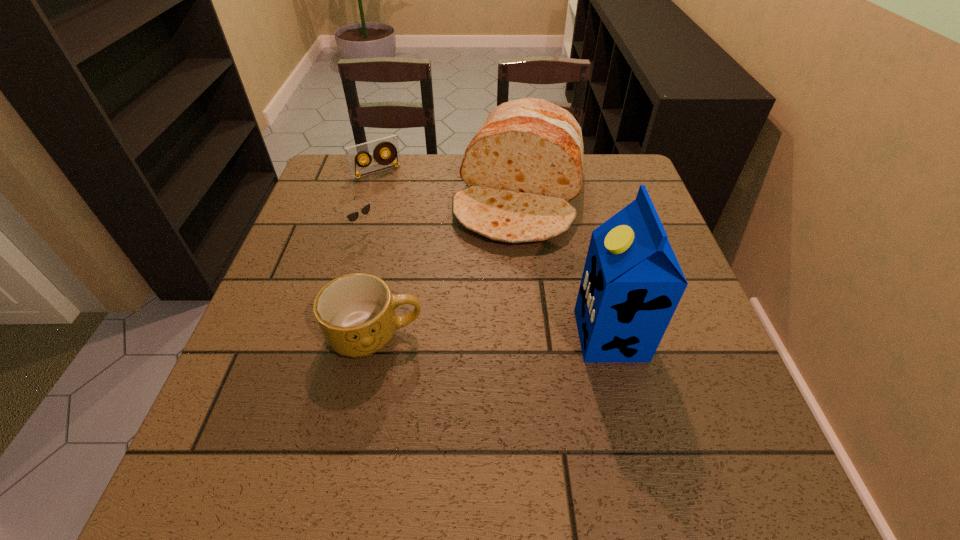
Find the location of a particular element. The image size is (960, 540). free space between the carton and the videotape is located at coordinates [x=493, y=254].

Where is `free spot between the sunglasses and the videotape`? free spot between the sunglasses and the videotape is located at coordinates (370, 201).

This screenshot has width=960, height=540. I want to click on vacant space that is in between the carton and the videotape, so click(493, 254).

Locate an element on the screen. Image resolution: width=960 pixels, height=540 pixels. blank region between the fourth shortest object and the mug is located at coordinates (448, 266).

Identify which object is located as the second nearest to the sunglasses. Please provide its 2D coordinates. Your answer should be formatted as a tuple, i.e. [(x, y)], where the tuple contains the x and y coordinates of a point satisfying the conditions above.

[(525, 163)]

Locate which object ranks third in proximity to the bread. Please provide its 2D coordinates. Your answer should be formatted as a tuple, i.e. [(x, y)], where the tuple contains the x and y coordinates of a point satisfying the conditions above.

[(356, 312)]

Where is `free point that satisfies the following two spatial constraints: 1. on the front side of the mug; 2. on the side with the handle of the videotape`? This screenshot has width=960, height=540. free point that satisfies the following two spatial constraints: 1. on the front side of the mug; 2. on the side with the handle of the videotape is located at coordinates (328, 335).

The width and height of the screenshot is (960, 540). I want to click on free space that satisfies the following two spatial constraints: 1. on the front side of the mug; 2. on the side with the handle of the videotape, so click(x=328, y=335).